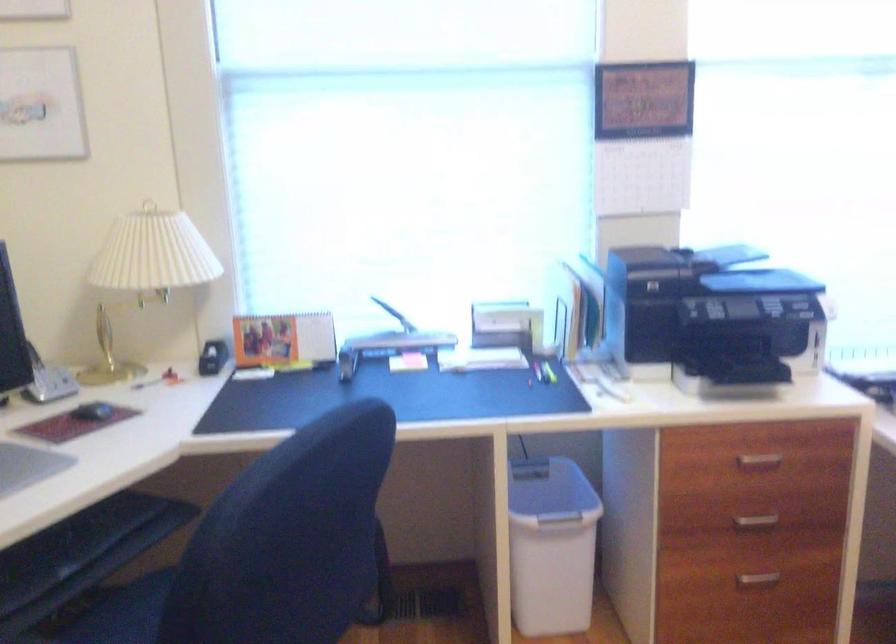
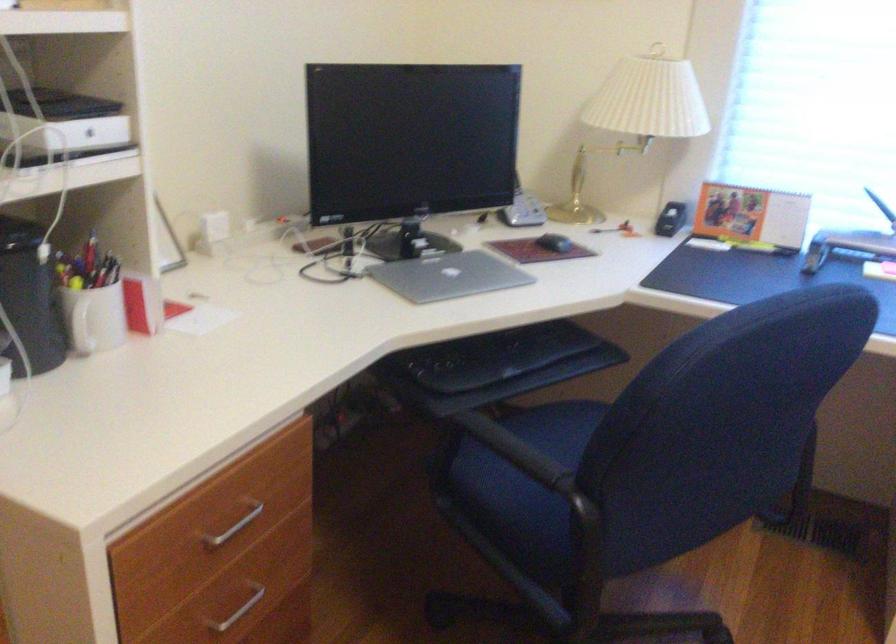
Locate, in the second image, the point that corresponds to (92,415) in the first image.

(554, 243)